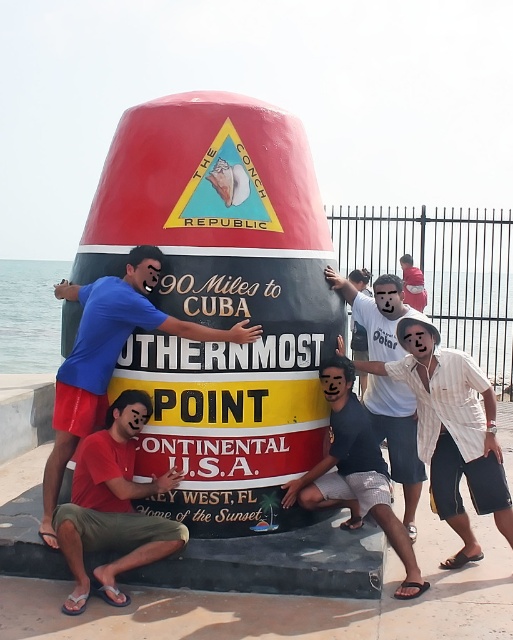
Is point (503, 499) closer to camera compared to point (116, 460)?

No, it is behind (116, 460).

Consider the image. Between white striped shirt at center and red matte shirt at lower left, which one appears on the right side from the viewer's perspective?

From the viewer's perspective, white striped shirt at center appears more on the right side.

Identify the location of white striped shirt at center. The height and width of the screenshot is (640, 513). (452, 433).

Does white striped shirt at center have a lesser width compared to blue t-shirt at lower left?

Yes, white striped shirt at center is thinner than blue t-shirt at lower left.

Can you confirm if white striped shirt at center is bigger than blue t-shirt at lower left?

No, white striped shirt at center is not bigger than blue t-shirt at lower left.

Identify the location of white striped shirt at center. (452, 433).

What are the coordinates of `white striped shirt at center` in the screenshot? It's located at (452, 433).

Does blue t-shirt at lower left appear under white cotton shirt at upper center?

No.

Who is shorter, blue t-shirt at lower left or white cotton shirt at upper center?

blue t-shirt at lower left

Does point (88, 355) come farther from viewer compared to point (399, 384)?

No, it is in front of (399, 384).

Identify the location of blue t-shirt at lower left. The height and width of the screenshot is (640, 513). (108, 356).